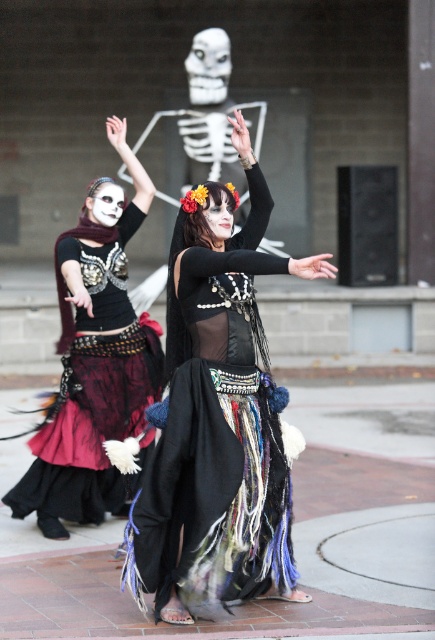
Question: Which point appears closest to the camera in this image?

Choices:
 (A) 194,560
 (B) 133,428

Answer: (A)

Question: Which point is closer to the camera taking this photo?

Choices:
 (A) (271, 477)
 (B) (160, 352)

Answer: (A)

Question: Can you confirm if black lace skirt at center is bigger than matte black dress at center?

Choices:
 (A) no
 (B) yes

Answer: (B)

Question: Is black lace skirt at center to the left of matte black dress at center from the viewer's perspective?

Choices:
 (A) yes
 (B) no

Answer: (B)

Question: Can you confirm if black lace skirt at center is positioned to the right of matte black dress at center?

Choices:
 (A) yes
 (B) no

Answer: (A)